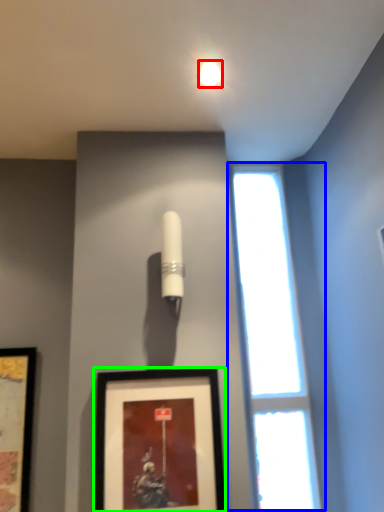
Question: Which object is positioned farthest from lighting (highlighted by a red box)? Select from window (highlighted by a blue box) and picture frame (highlighted by a green box).

Choices:
 (A) window
 (B) picture frame

Answer: (B)